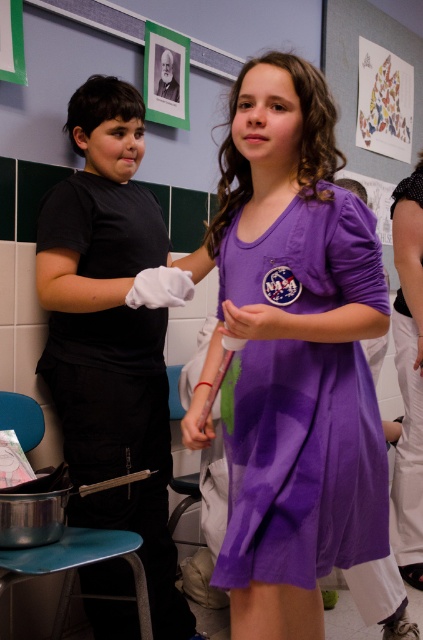
From the picture: You are a teacher in the classroom. You need to move the metallic blue stool at lower left to the back of the purple cotton dress at center. Is the stool currently positioned in front of or behind the dress?

The purple cotton dress at center is in front of the metallic blue stool at lower left, so the stool is currently behind the dress. To move it to the back, you would need to place it further behind the dress.